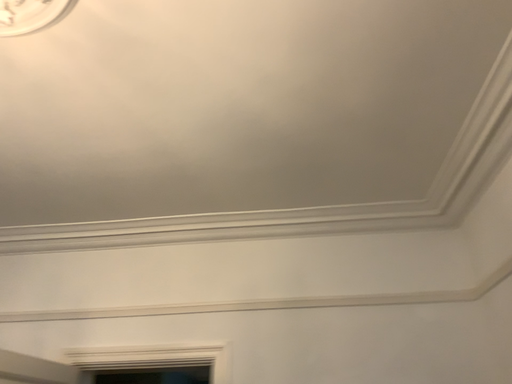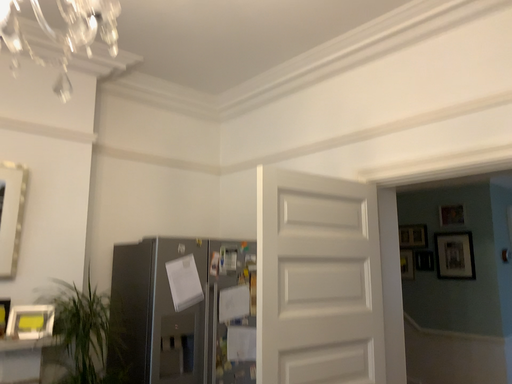
Question: Which way did the camera rotate in the video?

Choices:
 (A) rotated downward
 (B) rotated upward

Answer: (A)